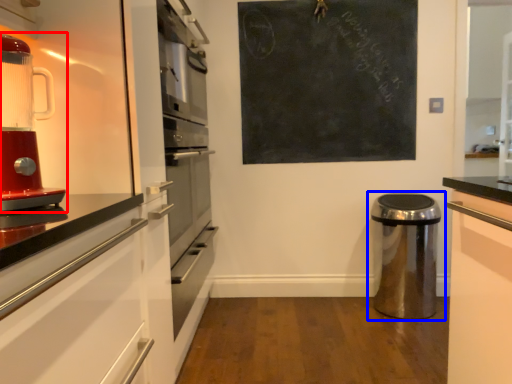
Question: Which of the following is the farthest to the observer, home appliance (highlighted by a red box) or waste container (highlighted by a blue box)?

Choices:
 (A) home appliance
 (B) waste container

Answer: (B)